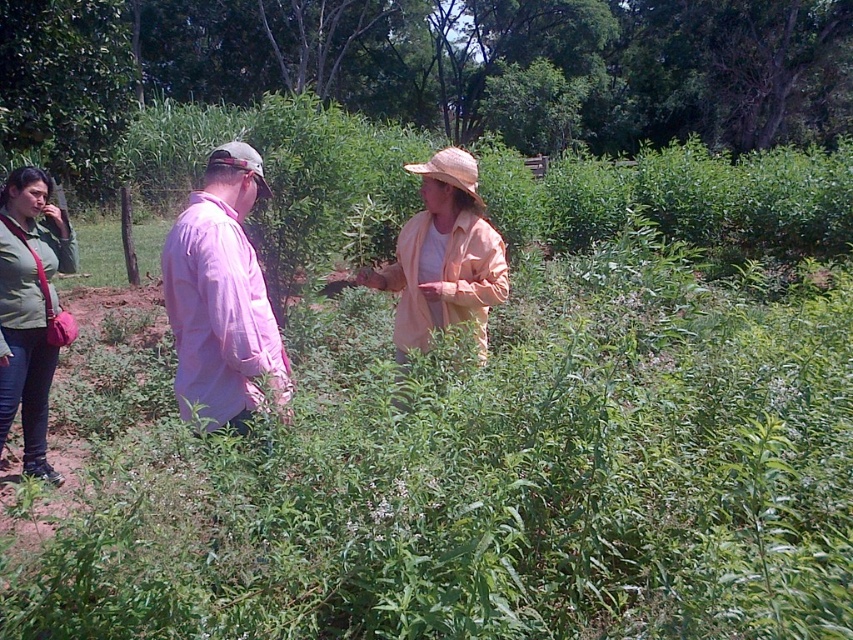
Does point (172, 280) come behind point (22, 170)?

No.

Which of these two, pink cotton shirt at center or matte green jacket at lower left, stands taller?

Standing taller between the two is matte green jacket at lower left.

Where is `pink cotton shirt at center`? This screenshot has height=640, width=853. pink cotton shirt at center is located at coordinates (221, 296).

Is matte green jacket at lower left thinner than straw at center?

Yes.

Which of these two, matte green jacket at lower left or straw at center, stands shorter?

Standing shorter between the two is matte green jacket at lower left.

Who is more forward, (x=32, y=193) or (x=244, y=150)?

Point (x=244, y=150) is more forward.

At what (x,y) coordinates should I click in order to perform the action: click on matte green jacket at lower left. Please return your answer as a coordinate pair (x, y). This screenshot has height=640, width=853. Looking at the image, I should click on (28, 308).

Is strawmaterial/texturehat at center to the right of straw at center from the viewer's perspective?

Indeed, strawmaterial/texturehat at center is positioned on the right side of straw at center.

Is strawmaterial/texturehat at center closer to the viewer compared to straw at center?

No, it is behind straw at center.

Who is more distant from viewer, (438, 164) or (259, 163)?

Positioned behind is point (438, 164).

Find the location of `strawmaterial/texturehat at center`. strawmaterial/texturehat at center is located at coordinates (451, 170).